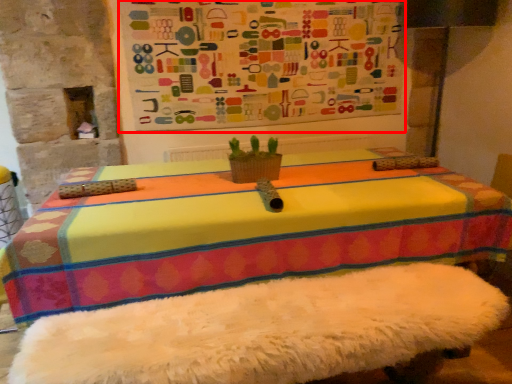
Question: From the image's perspective, considering the relative positions of bulletin board (annotated by the red box) and flowerpot in the image provided, where is bulletin board (annotated by the red box) located with respect to the staircase?

Choices:
 (A) above
 (B) below

Answer: (A)